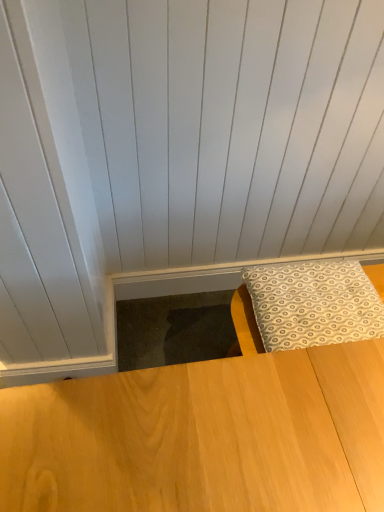
Question: Should I look upward or downward to see patterned fabric pillow at lower right?

Choices:
 (A) up
 (B) down

Answer: (B)